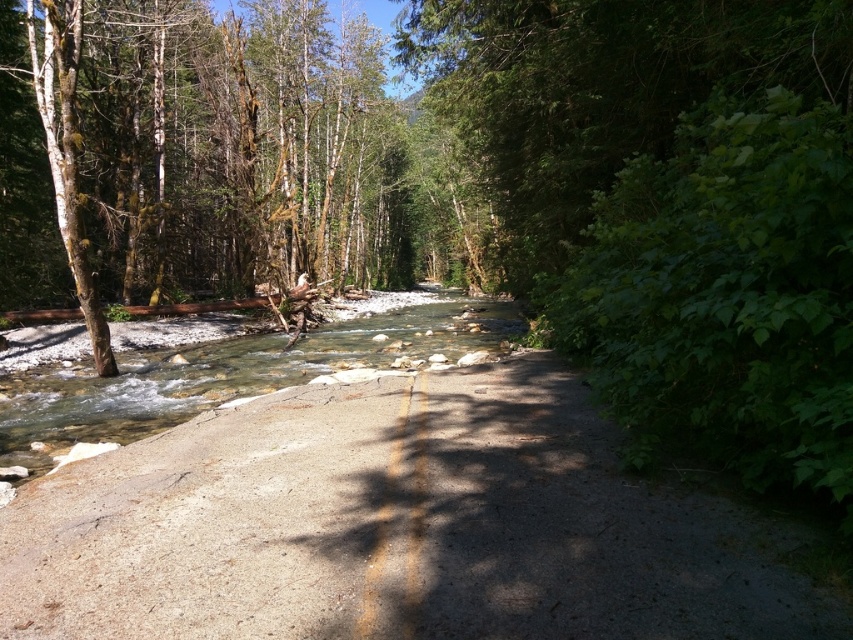
Question: Does gray concrete road at center have a smaller size compared to green mossy tree at left?

Choices:
 (A) yes
 (B) no

Answer: (A)

Question: Is gray concrete road at center thinner than clear water at center?

Choices:
 (A) no
 (B) yes

Answer: (B)

Question: Considering the real-world distances, which object is farthest from the clear water at center?

Choices:
 (A) green mossy tree at left
 (B) gray concrete road at center

Answer: (B)

Question: Which point is closer to the camera?

Choices:
 (A) (251, 612)
 (B) (314, 189)

Answer: (A)

Question: Does green mossy tree at left have a lesser width compared to clear water at center?

Choices:
 (A) yes
 (B) no

Answer: (B)

Question: Which object is farther from the camera taking this photo?

Choices:
 (A) gray concrete road at center
 (B) clear water at center

Answer: (B)